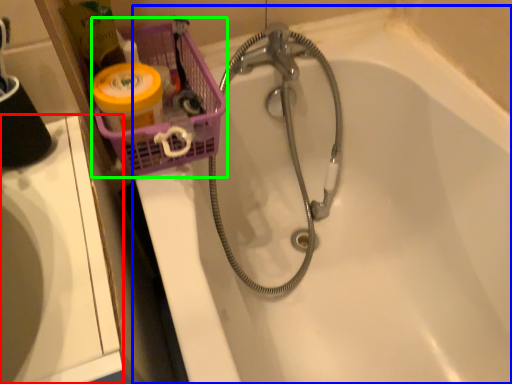
Question: Considering the real-world distances, which object is closest to sink (highlighted by a red box)? bathtub (highlighted by a blue box) or basket (highlighted by a green box).

Choices:
 (A) bathtub
 (B) basket

Answer: (B)